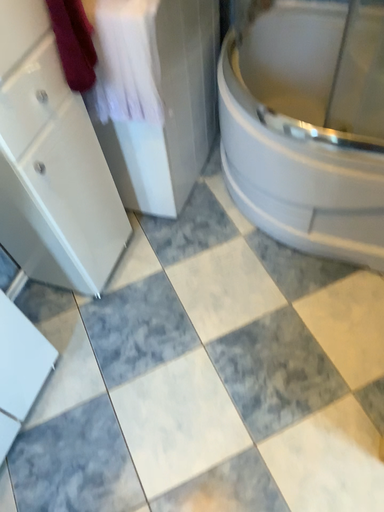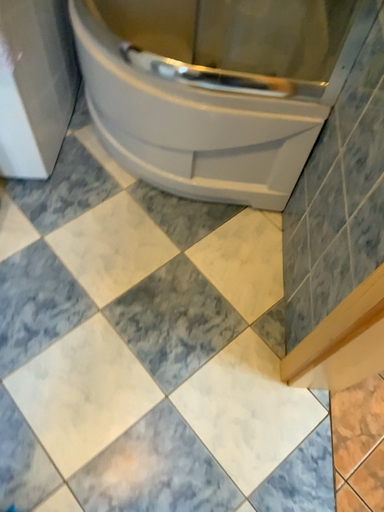
Question: Which way did the camera rotate in the video?

Choices:
 (A) rotated right
 (B) rotated left

Answer: (A)